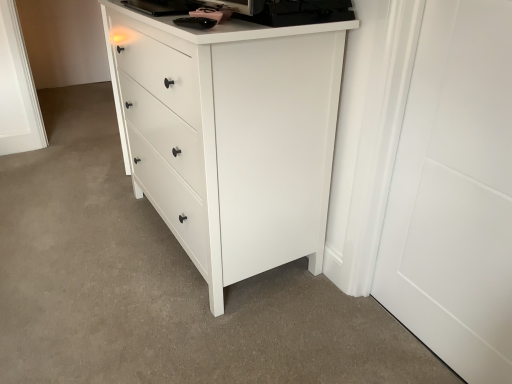
Identify the location of white matte chest of drawers at center. (231, 136).

The height and width of the screenshot is (384, 512). Describe the element at coordinates (231, 136) in the screenshot. I see `white matte chest of drawers at center` at that location.

In order to face white matte chest of drawers at center, should I rotate leftwards or rightwards?

A 6.899 degree turn to the left will do.

Image resolution: width=512 pixels, height=384 pixels. What do you see at coordinates (455, 192) in the screenshot?
I see `white matte door at right` at bounding box center [455, 192].

Where is `white matte door at right`? The width and height of the screenshot is (512, 384). white matte door at right is located at coordinates (455, 192).

Based on the photo, measure the distance between white matte door at right and camera.

They are 36.92 inches apart.

Measure the distance between point (x=471, y=230) and camera.

Point (x=471, y=230) is 1.15 meters away from camera.

Where is `white matte chest of drawers at center`? This screenshot has width=512, height=384. white matte chest of drawers at center is located at coordinates (231, 136).

Is white matte door at right to the left or to the right of white matte chest of drawers at center in the image?

Clearly, white matte door at right is on the right of white matte chest of drawers at center in the image.

Considering the positions of objects white matte door at right and white matte chest of drawers at center in the image provided, who is in front, white matte door at right or white matte chest of drawers at center?

white matte door at right.

Which is less distant, (511,229) or (292,219)?

Point (511,229) appears to be closer to the viewer than point (292,219).

From the image's perspective, between white matte door at right and white matte chest of drawers at center, who is located below?

white matte door at right is shown below in the image.

From a real-world perspective, is white matte door at right located higher than white matte chest of drawers at center?

A: Yes.

Which object is wider, white matte door at right or white matte chest of drawers at center?

With larger width is white matte chest of drawers at center.

Which of these two, white matte door at right or white matte chest of drawers at center, stands shorter?

white matte chest of drawers at center.

Considering the relative sizes of white matte door at right and white matte chest of drawers at center in the image provided, is white matte door at right bigger than white matte chest of drawers at center?

No, white matte door at right is not bigger than white matte chest of drawers at center.

Is white matte door at right completely or partially outside of white matte chest of drawers at center?

That's correct, white matte door at right is outside of white matte chest of drawers at center.

Based on the photo, is white matte door at right far away from white matte chest of drawers at center?

white matte door at right is actually quite close to white matte chest of drawers at center.

Is white matte door at right looking in the opposite direction of white matte chest of drawers at center?

white matte door at right is not turned away from white matte chest of drawers at center.

The image size is (512, 384). What are the coordinates of `door below the white matte chest of drawers at center (from the image's perspective)` in the screenshot? It's located at (455, 192).

Which object is positioned more to the right, white matte chest of drawers at center or white matte door at right?

Positioned to the right is white matte door at right.

Is the depth of white matte chest of drawers at center less than that of white matte door at right?

No.

Which is more distant, [243,144] or [476,255]?

The point [243,144] is farther.

From the image's perspective, between white matte chest of drawers at center and white matte door at right, which one is located above?

From the image's view, white matte chest of drawers at center is above.

From a real-world perspective, which object stands above the other?

white matte door at right is physically above.

In terms of width, does white matte chest of drawers at center look wider or thinner when compared to white matte door at right?

Considering their sizes, white matte chest of drawers at center looks broader than white matte door at right.

Considering the sizes of white matte chest of drawers at center and white matte door at right in the image, is white matte chest of drawers at center taller or shorter than white matte door at right?

Clearly, white matte chest of drawers at center is shorter compared to white matte door at right.

Considering the relative sizes of white matte chest of drawers at center and white matte door at right in the image provided, is white matte chest of drawers at center smaller than white matte door at right?

Incorrect, white matte chest of drawers at center is not smaller in size than white matte door at right.

Is white matte chest of drawers at center located outside white matte door at right?

Indeed, white matte chest of drawers at center is completely outside white matte door at right.

Does white matte chest of drawers at center touch white matte door at right?

No.

Is white matte chest of drawers at center facing towards white matte door at right?

No.

Can you tell me how much white matte chest of drawers at center and white matte door at right differ in facing direction?

There is a 0.859-degree angle between the facing directions of white matte chest of drawers at center and white matte door at right.

Measure the distance between white matte chest of drawers at center and white matte door at right.

white matte chest of drawers at center is 20.28 inches away from white matte door at right.

At what (x,y) coordinates should I click in order to perform the action: click on door lying on the right of white matte chest of drawers at center. Please return your answer as a coordinate pair (x, y). This screenshot has width=512, height=384. Looking at the image, I should click on (455, 192).

I want to click on door in front of the white matte chest of drawers at center, so click(455, 192).

At what (x,y) coordinates should I click in order to perform the action: click on the chest of drawers located underneath the white matte door at right (from a real-world perspective). Please return your answer as a coordinate pair (x, y). The image size is (512, 384). Looking at the image, I should click on (231, 136).